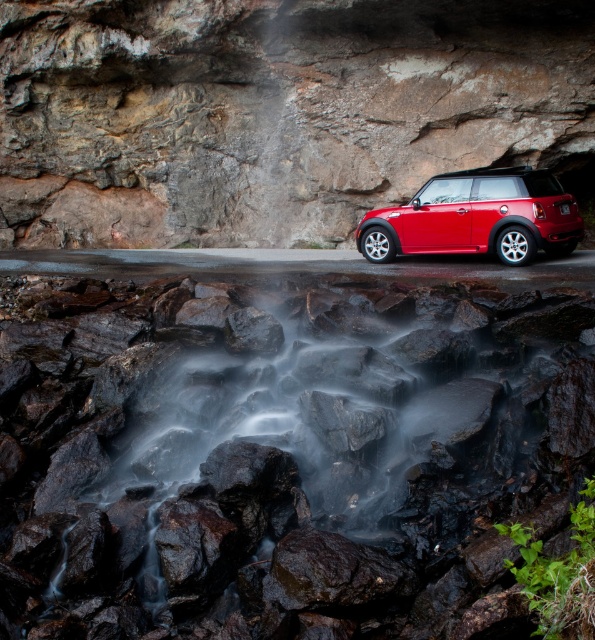
You are a photographer planning to capture a wide shot of the scene. The matte rock cliff at upper center and the glossy metallic car at center are both in your frame. Considering their sizes, which object would appear more dominant in the composition?

The matte rock cliff at upper center would appear more dominant in the composition because it is larger in size than the glossy metallic car at center.

You are a photographer planning to place a tripod on the glossy rock at center and the matte rock cliff at upper center. Which rock surface would allow for a more stable setup, considering their textures?

The matte rock cliff at upper center provides a more stable surface for the tripod because its matte texture likely offers better grip compared to the glossy rock at center, which may be slippery due to its reflective surface.